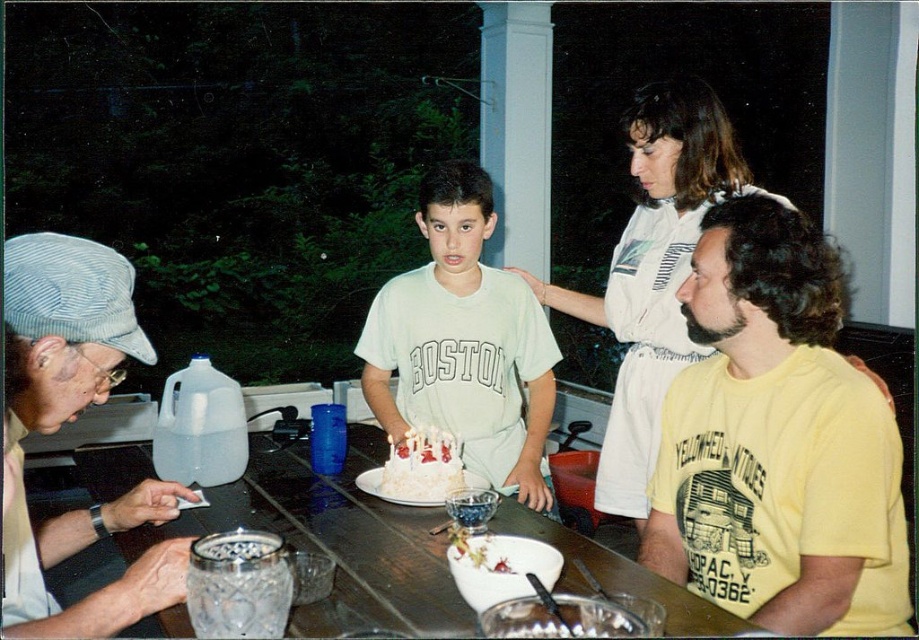
Describe the element at coordinates (777, 442) in the screenshot. I see `yellow cotton t-shirt at lower right` at that location.

Locate an element on the screen. This screenshot has width=919, height=640. yellow cotton t-shirt at lower right is located at coordinates (777, 442).

Does point (62, 540) lie in front of point (471, 396)?

Yes, it is in front of point (471, 396).

This screenshot has width=919, height=640. In order to click on khaki fabric cap at left in this screenshot , I will do `click(71, 420)`.

You are a GUI agent. You are given a task and a screenshot of the screen. Output one action in this format:
    pyautogui.click(x=<x>, y=<y>)
    Task: Click on the khaki fabric cap at left
    The width and height of the screenshot is (919, 640).
    Given the screenshot: What is the action you would take?
    pyautogui.click(x=71, y=420)

Does point (746, 538) come in front of point (525, 332)?

That is True.

Which is more to the right, yellow cotton t-shirt at lower right or white cotton shirt at center?

yellow cotton t-shirt at lower right

Find the location of a particular element. The height and width of the screenshot is (640, 919). yellow cotton t-shirt at lower right is located at coordinates (777, 442).